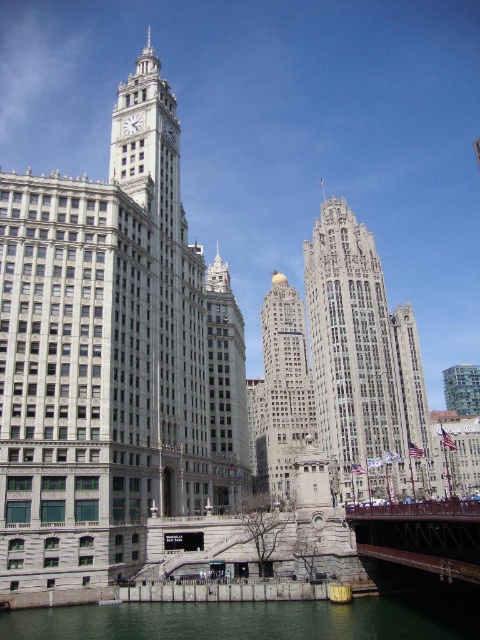
Question: Which point is farther to the camera?

Choices:
 (A) green concrete river at lower center
 (B) white marble clock at upper center
 (C) gold polished stone tower at center
 (D) stone/brick skyscraper at center

Answer: (C)

Question: Which point is farther to the camera?

Choices:
 (A) green concrete river at lower center
 (B) gold polished stone tower at center
 (C) gray stone tower at center

Answer: (B)

Question: Estimate the real-world distances between objects in this image. Which object is farther from the metallic red bridge at lower right?

Choices:
 (A) white marble clock at upper center
 (B) gray stone clock tower at center
 (C) green concrete river at lower center

Answer: (A)

Question: Is gray stone clock tower at center behind metallic red bridge at lower right?

Choices:
 (A) no
 (B) yes

Answer: (B)

Question: Observing the image, what is the correct spatial positioning of green concrete river at lower center in reference to white marble clock at upper center?

Choices:
 (A) above
 (B) below

Answer: (B)

Question: Is gray stone clock tower at center bigger than white marble clock at upper center?

Choices:
 (A) yes
 (B) no

Answer: (A)